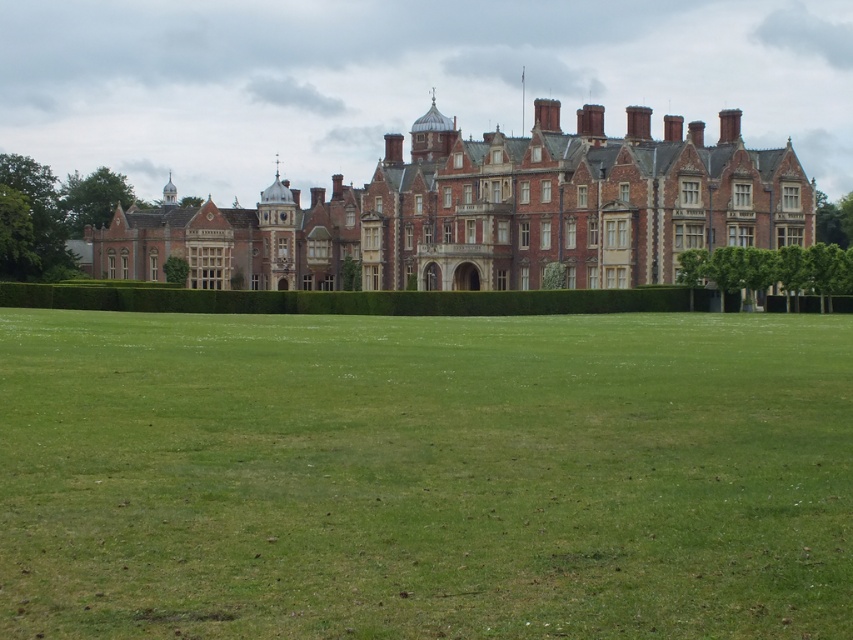
You are standing at the center of the lawn in front of the mansion. If you walk straight towards the building, will you first step onto the green grass at lower center?

The green grass at lower center is located at point (424, 476) in 2D coordinates, which places it at the lower center of the image. Since you are standing at the center of the lawn and walking straight towards the building, you would first step onto the green grass at lower center as it is directly ahead in your path.

Looking at this image, you are standing on the green grass at lower center and want to walk towards the brick stone mansion at center. Which direction should you move to get closer to the mansion?

Since the green grass at lower center is closer to the viewer than the brick stone mansion at center, you should move forward towards the mansion, as it is located further away from your current position on the grass.